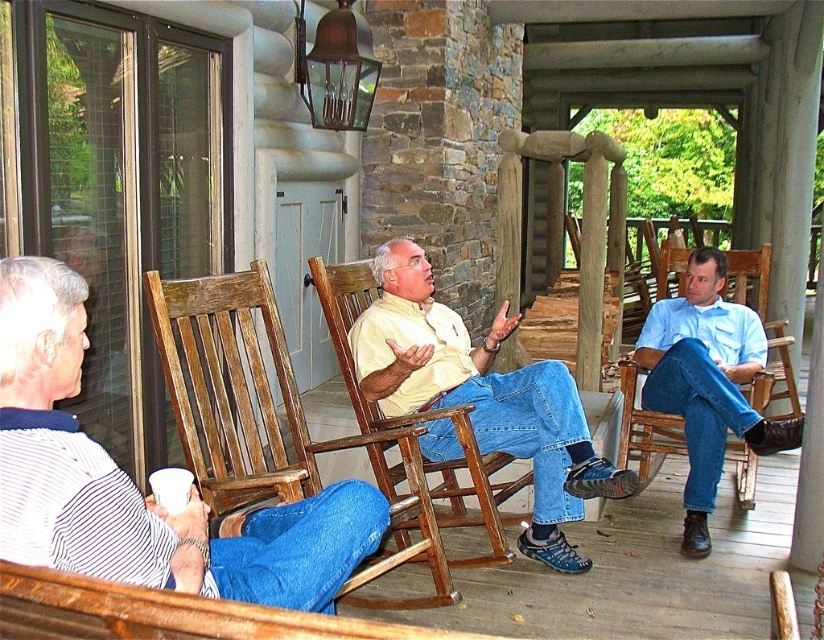
Question: Which point is farther to the camera?

Choices:
 (A) matte yellow shirt at center
 (B) striped cotton shirt at left
 (C) light blue shirt at right

Answer: (C)

Question: Does striped cotton shirt at left have a larger size compared to light blue shirt at right?

Choices:
 (A) no
 (B) yes

Answer: (A)

Question: Where is matte yellow shirt at center located in relation to light blue shirt at right in the image?

Choices:
 (A) left
 (B) right

Answer: (A)

Question: In this image, where is striped cotton shirt at left located relative to matte yellow shirt at center?

Choices:
 (A) left
 (B) right

Answer: (A)

Question: Among these points, which one is farthest from the camera?

Choices:
 (A) (110, 522)
 (B) (394, 362)

Answer: (B)

Question: Which point is farther from the camera taking this photo?

Choices:
 (A) coord(73,426)
 (B) coord(429,433)
 (C) coord(673,362)

Answer: (C)